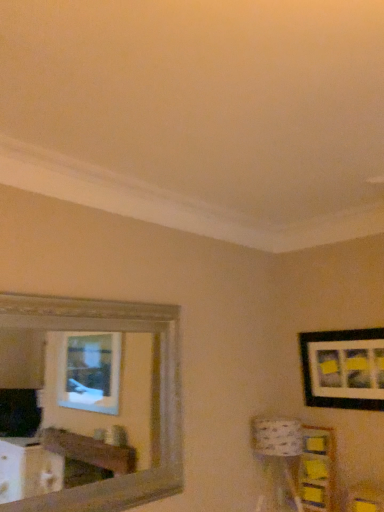
Find the location of `yellow paper at lower right`. yellow paper at lower right is located at coordinates (317, 469).

Image resolution: width=384 pixels, height=512 pixels. I want to click on black matte picture frame at upper right, so click(343, 369).

Does yellow paper at lower right have a lesser width compared to patterned fabric lampshade at lower right?

Yes, yellow paper at lower right is thinner than patterned fabric lampshade at lower right.

Considering the sizes of objects yellow paper at lower right and patterned fabric lampshade at lower right in the image provided, who is shorter, yellow paper at lower right or patterned fabric lampshade at lower right?

With less height is yellow paper at lower right.

From the image's perspective, between yellow paper at lower right and patterned fabric lampshade at lower right, which one is located above?

patterned fabric lampshade at lower right.

Locate an element on the screen. Image resolution: width=384 pixels, height=512 pixels. table lamp that appears in front of the yellow paper at lower right is located at coordinates (279, 445).

Can you confirm if wooden frame mirror at upper left is taller than yellow paper at lower right?

Yes.

Would you say yellow paper at lower right is part of wooden frame mirror at upper left's contents?

No, wooden frame mirror at upper left does not contain yellow paper at lower right.

Is wooden frame mirror at upper left next to yellow paper at lower right and touching it?

No, wooden frame mirror at upper left is not beside yellow paper at lower right.

From a real-world perspective, is wooden frame mirror at upper left over black matte picture frame at upper right?

No, from a real-world perspective, wooden frame mirror at upper left is not above black matte picture frame at upper right.

Do you think wooden frame mirror at upper left is within black matte picture frame at upper right, or outside of it?

wooden frame mirror at upper left is located beyond the bounds of black matte picture frame at upper right.

Is wooden frame mirror at upper left further to camera compared to black matte picture frame at upper right?

That is False.

The image size is (384, 512). Find the location of `picture frame below the wooden frame mirror at upper left (from the image's perspective)`. picture frame below the wooden frame mirror at upper left (from the image's perspective) is located at coordinates (343, 369).

Consider the image. Is black matte picture frame at upper right looking in the opposite direction of yellow paper at lower right?

No.

Considering the positions of point (313, 334) and point (319, 474), is point (313, 334) closer or farther from the camera than point (319, 474)?

Point (313, 334).

Locate an element on the screen. picture frame above the yellow paper at lower right (from a real-world perspective) is located at coordinates (343, 369).

Who is more distant, black matte picture frame at upper right or yellow paper at lower right?

yellow paper at lower right is further away from the camera.

Which of these two, wooden frame mirror at upper left or patterned fabric lampshade at lower right, is wider?

With larger width is patterned fabric lampshade at lower right.

Is wooden frame mirror at upper left further to camera compared to patterned fabric lampshade at lower right?

No.

Can you tell me how much wooden frame mirror at upper left and patterned fabric lampshade at lower right differ in facing direction?

85.8 degrees separate the facing orientations of wooden frame mirror at upper left and patterned fabric lampshade at lower right.

Which of these two, wooden frame mirror at upper left or patterned fabric lampshade at lower right, is smaller?

Smaller between the two is patterned fabric lampshade at lower right.

Is the depth of patterned fabric lampshade at lower right less than that of wooden frame mirror at upper left?

No, patterned fabric lampshade at lower right is behind wooden frame mirror at upper left.

Does patterned fabric lampshade at lower right have a smaller size compared to wooden frame mirror at upper left?

Correct, patterned fabric lampshade at lower right occupies less space than wooden frame mirror at upper left.

Which object is thinner, patterned fabric lampshade at lower right or wooden frame mirror at upper left?

With smaller width is wooden frame mirror at upper left.

Consider the image. Do you think patterned fabric lampshade at lower right is within wooden frame mirror at upper left, or outside of it?

patterned fabric lampshade at lower right cannot be found inside wooden frame mirror at upper left.

Is black matte picture frame at upper right bigger than wooden frame mirror at upper left?

No, black matte picture frame at upper right is not bigger than wooden frame mirror at upper left.

Considering the points (317, 383) and (78, 501), which point is in front, point (317, 383) or point (78, 501)?

The point (78, 501) is closer to the camera.

Is black matte picture frame at upper right facing towards wooden frame mirror at upper left?

Yes, black matte picture frame at upper right is oriented towards wooden frame mirror at upper left.

Is black matte picture frame at upper right further to camera compared to wooden frame mirror at upper left?

Yes.

Find the location of `table lamp on the left of yellow paper at lower right`. table lamp on the left of yellow paper at lower right is located at coordinates (279, 445).

The image size is (384, 512). I want to click on shelf on the right side of wooden frame mirror at upper left, so click(317, 469).

Which object lies further to the anchor point black matte picture frame at upper right, wooden frame mirror at upper left or patterned fabric lampshade at lower right?

The object further to black matte picture frame at upper right is wooden frame mirror at upper left.

Estimate the real-world distances between objects in this image. Which object is closer to patterned fabric lampshade at lower right, wooden frame mirror at upper left or black matte picture frame at upper right?

The object closer to patterned fabric lampshade at lower right is black matte picture frame at upper right.

Which object lies further to the anchor point patterned fabric lampshade at lower right, black matte picture frame at upper right or yellow paper at lower right?

The object further to patterned fabric lampshade at lower right is black matte picture frame at upper right.

Based on their spatial positions, is patterned fabric lampshade at lower right or yellow paper at lower right further from wooden frame mirror at upper left?

yellow paper at lower right is positioned further to the anchor wooden frame mirror at upper left.

Which object lies further to the anchor point black matte picture frame at upper right, patterned fabric lampshade at lower right or wooden frame mirror at upper left?

Based on the image, wooden frame mirror at upper left appears to be further to black matte picture frame at upper right.

Which object lies nearer to the anchor point yellow paper at lower right, black matte picture frame at upper right or patterned fabric lampshade at lower right?

patterned fabric lampshade at lower right is positioned closer to the anchor yellow paper at lower right.

In the scene shown: Looking at the image, which one is located further to black matte picture frame at upper right, yellow paper at lower right or wooden frame mirror at upper left?

wooden frame mirror at upper left lies further to black matte picture frame at upper right than the other object.

Consider the image. When comparing their distances from black matte picture frame at upper right, does wooden frame mirror at upper left or yellow paper at lower right seem closer?

yellow paper at lower right lies closer to black matte picture frame at upper right than the other object.

You are a GUI agent. You are given a task and a screenshot of the screen. Output one action in this format:
    pyautogui.click(x=<x>, y=<y>)
    Task: Click on the table lamp between black matte picture frame at upper right and yellow paper at lower right vertically
    
    Given the screenshot: What is the action you would take?
    pyautogui.click(x=279, y=445)

The height and width of the screenshot is (512, 384). What are the coordinates of `table lamp situated between wooden frame mirror at upper left and black matte picture frame at upper right from left to right` in the screenshot? It's located at (279, 445).

Locate an element on the screen. table lamp situated between wooden frame mirror at upper left and yellow paper at lower right from left to right is located at coordinates (279, 445).

Where is `shelf between wooden frame mirror at upper left and black matte picture frame at upper right in the horizontal direction`? This screenshot has height=512, width=384. shelf between wooden frame mirror at upper left and black matte picture frame at upper right in the horizontal direction is located at coordinates (317, 469).